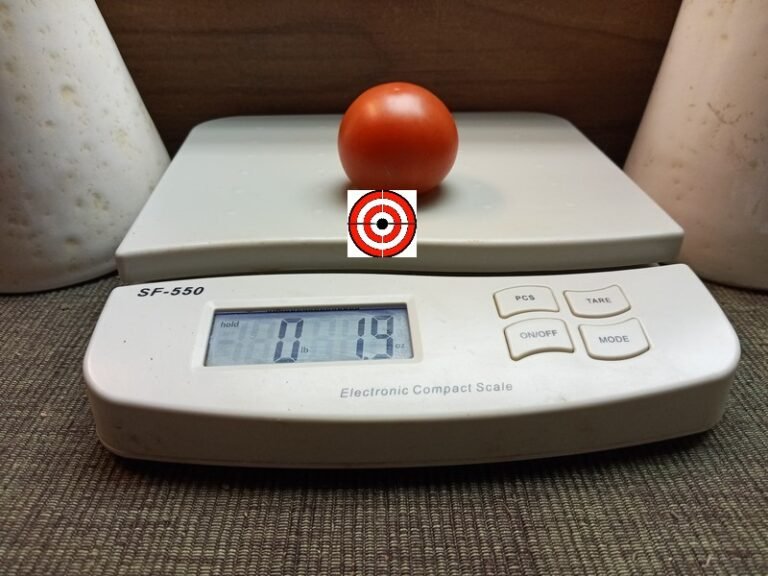
I want to click on tan wood background, so click(x=405, y=36).